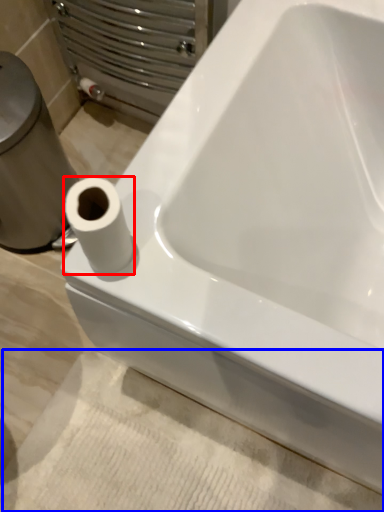
Question: Which object appears closest to the camera in this image, toilet paper (highlighted by a red box) or bath mat (highlighted by a blue box)?

Choices:
 (A) toilet paper
 (B) bath mat

Answer: (A)